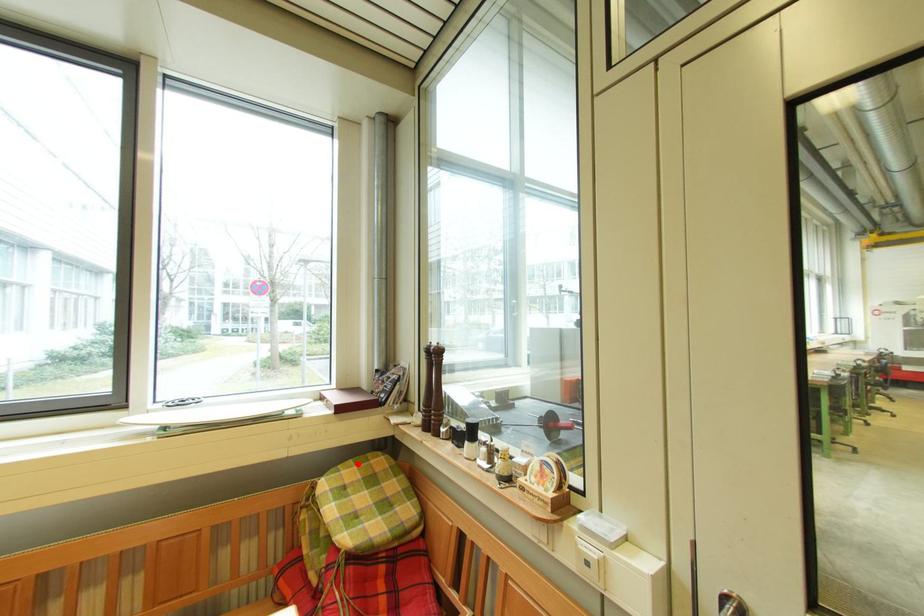
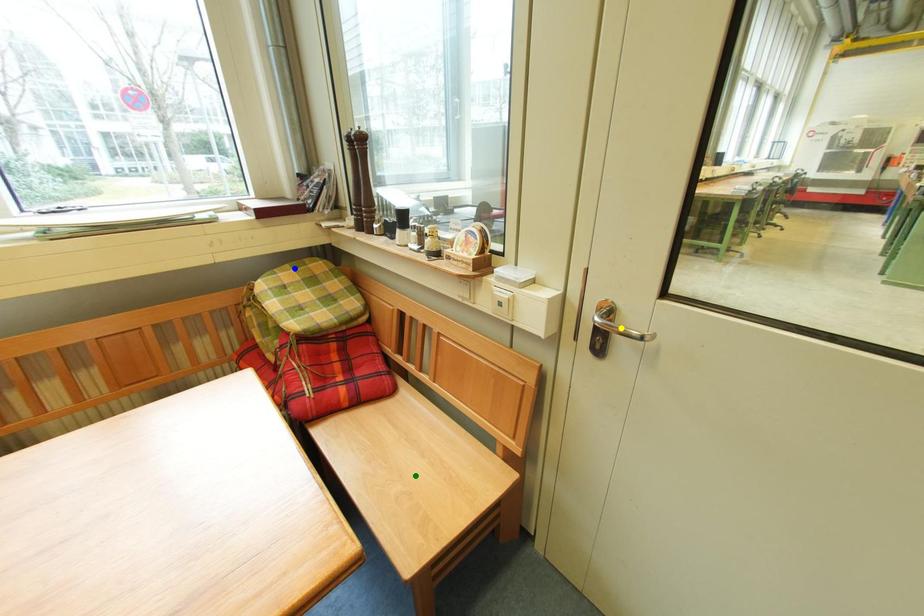
Question: I am providing you with two images of the same scene from different viewpoints. A red point is marked on the first image. You are given multiple points on the second image. Which point in image 2 represents the same 3d spot as the red point in image 1?

Choices:
 (A) yellow point
 (B) green point
 (C) blue point

Answer: (C)